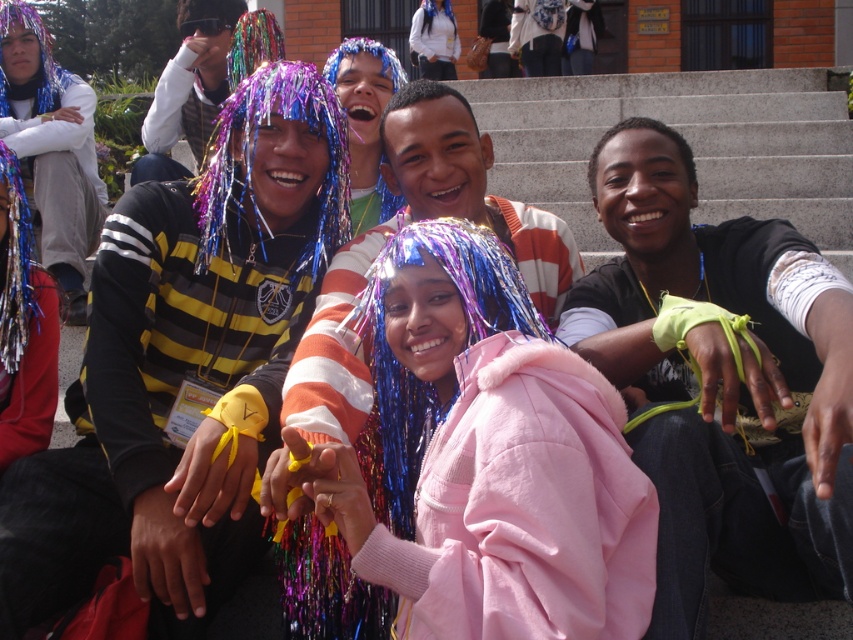
You are a photographer trying to capture a closeup of the neon green fabric at center. The pink fleece jacket at center is blocking your view. Can you determine if you can move the jacket slightly to the right to get a clear shot of the neon green fabric?

The pink fleece jacket at center is larger in size than neon green fabric at center. Moving the jacket slightly to the right may allow the neon green fabric at center to become visible, but since the jacket is larger, it might still partially block the view. Adjust the position carefully.

You are a photographer trying to capture a group photo of the people on the concrete steps. You want to ensure everyone is in focus. The camera you are using has a depth of field that can cover 10 feet. Given the distance between the pink fleece jacket at center and the neon green fabric at center, will your camera be able to keep both in focus?

The distance between the pink fleece jacket at center and the neon green fabric at center is 9.47 feet, which is within the camera depth of field of 10 feet. Therefore, both objects will be in focus.